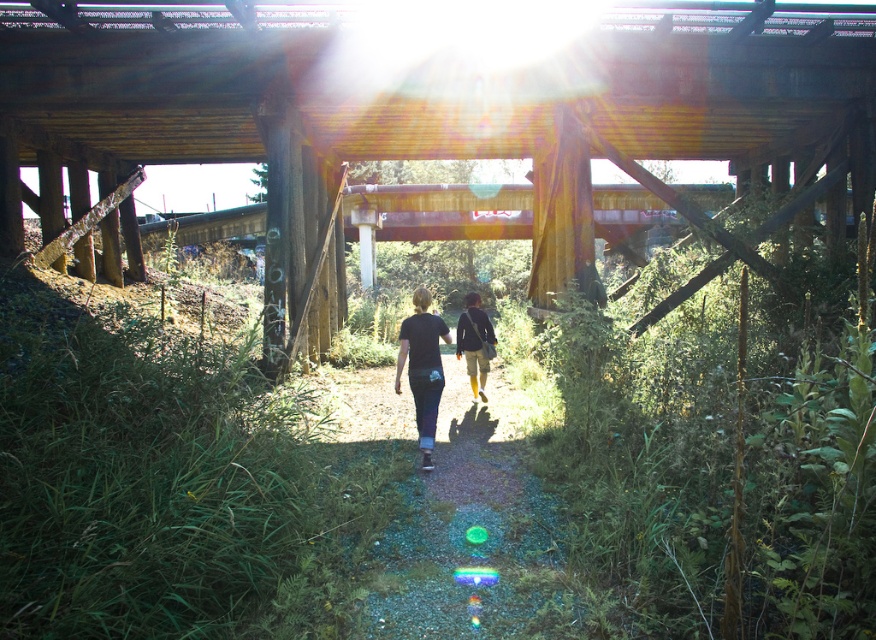
Question: Can you confirm if dirt path at center is wider than yellow fabric pants at center?

Choices:
 (A) no
 (B) yes

Answer: (A)

Question: Observing the image, what is the correct spatial positioning of dark gray cotton shirt at center in reference to yellow fabric pants at center?

Choices:
 (A) left
 (B) right

Answer: (A)

Question: Among these points, which one is nearest to the camera?

Choices:
 (A) (429, 355)
 (B) (463, 349)

Answer: (A)

Question: Which point is closer to the camera?

Choices:
 (A) dark gray cotton shirt at center
 (B) dirt path at center

Answer: (B)

Question: Which point is farther from the camera taking this photo?

Choices:
 (A) (675, 42)
 (B) (440, 371)
 (C) (486, 570)
 (D) (472, 336)

Answer: (D)

Question: Does rusty metal bridge at center appear on the left side of dirt path at center?

Choices:
 (A) yes
 (B) no

Answer: (A)